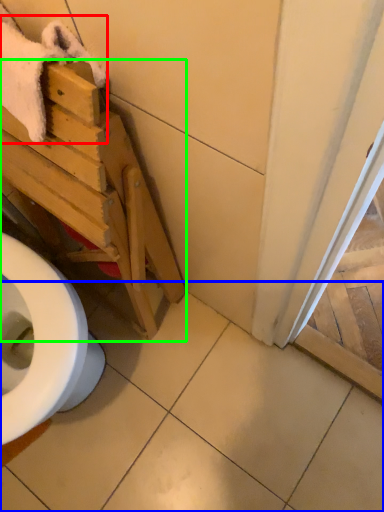
Question: Based on their relative distances, which object is nearer to bath towel (highlighted by a red box)? Choose from tile (highlighted by a blue box) and furniture (highlighted by a green box).

Choices:
 (A) tile
 (B) furniture

Answer: (B)